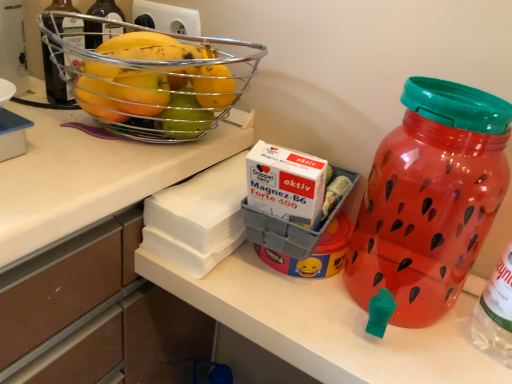
Question: Choose the correct answer: Is translucent plastic water jug at right inside metallic wire basket at upper left or outside it?

Choices:
 (A) inside
 (B) outside

Answer: (B)

Question: Considering the positions of translucent plastic water jug at right and metallic wire basket at upper left in the image, is translucent plastic water jug at right bigger or smaller than metallic wire basket at upper left?

Choices:
 (A) small
 (B) big

Answer: (A)

Question: From the image's perspective, relative to metallic wire basket at upper left, is translucent plastic water jug at right above or below?

Choices:
 (A) above
 (B) below

Answer: (B)

Question: Is metallic wire basket at upper left in front of or behind translucent plastic water jug at right in the image?

Choices:
 (A) front
 (B) behind

Answer: (B)

Question: In terms of width, does metallic wire basket at upper left look wider or thinner when compared to translucent plastic water jug at right?

Choices:
 (A) wide
 (B) thin

Answer: (A)

Question: From their relative heights in the image, would you say metallic wire basket at upper left is taller or shorter than translucent plastic water jug at right?

Choices:
 (A) short
 (B) tall

Answer: (A)

Question: Would you say metallic wire basket at upper left is to the left or to the right of translucent plastic water jug at right in the picture?

Choices:
 (A) right
 (B) left

Answer: (B)